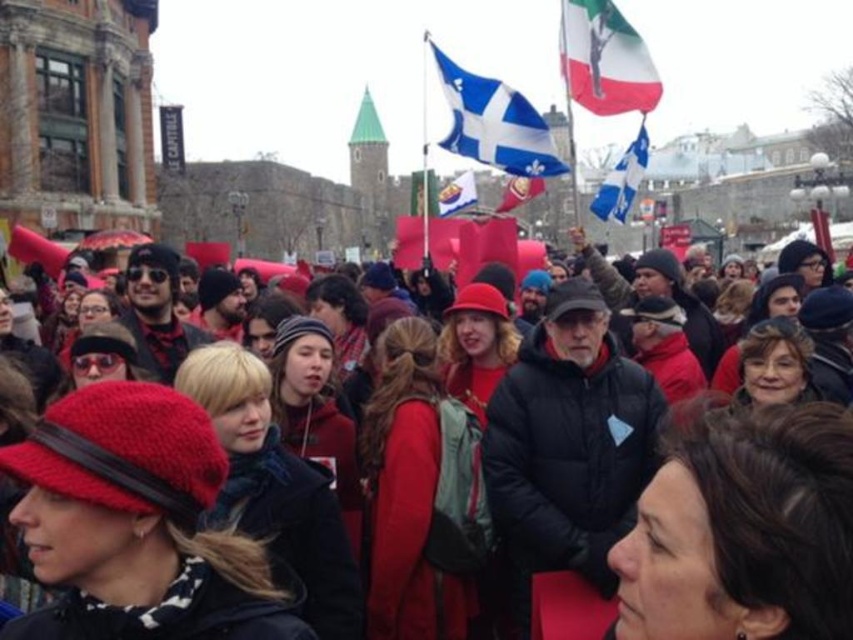
Is red knit hat at center positioned behind white fabric flag at upper right?

That is False.

What do you see at coordinates (741, 529) in the screenshot?
I see `red knit hat at center` at bounding box center [741, 529].

The height and width of the screenshot is (640, 853). What are the coordinates of `red knit hat at center` in the screenshot? It's located at (741, 529).

The image size is (853, 640). In order to click on red knit hat at center in this screenshot , I will do `click(741, 529)`.

From the picture: Between red knit hat at center and blue fabric flag at upper center, which one appears on the right side from the viewer's perspective?

Positioned to the right is blue fabric flag at upper center.

Locate an element on the screen. This screenshot has height=640, width=853. red knit hat at center is located at coordinates (741, 529).

Where is `red knit hat at center`? red knit hat at center is located at coordinates (741, 529).

Is point (642, 113) positioned in front of point (519, 184)?

Yes, it is in front of point (519, 184).

I want to click on white fabric flag at upper right, so tap(605, 60).

Describe the element at coordinates (605, 60) in the screenshot. Image resolution: width=853 pixels, height=640 pixels. I see `white fabric flag at upper right` at that location.

Locate an element on the screen. The width and height of the screenshot is (853, 640). white fabric flag at upper right is located at coordinates (605, 60).